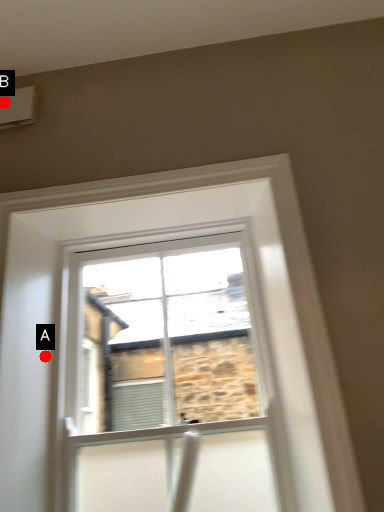
Question: Two points are circled on the image, labeled by A and B beside each circle. Among these points, which one is farthest from the camera?

Choices:
 (A) A is further
 (B) B is further

Answer: (B)